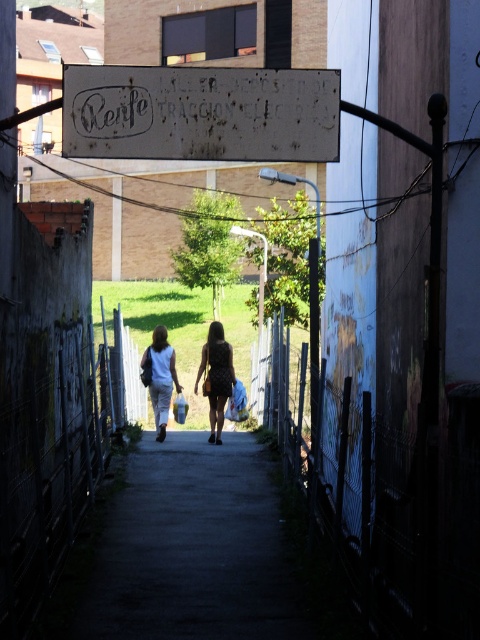
Does rusty metal sign at upper center appear under black dotted dress at center?

No.

Can you confirm if rusty metal sign at upper center is taller than black dotted dress at center?

No.

Does point (282, 92) lie in front of point (206, 371)?

Yes.

Locate an element on the screen. This screenshot has width=480, height=640. rusty metal sign at upper center is located at coordinates (201, 113).

Between point (208, 108) and point (156, 410), which one is positioned in front?

Point (208, 108) is in front.

Is rusty metal sign at upper center to the right of light blue sleeveless top at center from the viewer's perspective?

Indeed, rusty metal sign at upper center is positioned on the right side of light blue sleeveless top at center.

Is point (252, 122) farther from viewer compared to point (152, 392)?

No, it is not.

In order to click on rusty metal sign at upper center in this screenshot , I will do `click(201, 113)`.

Where is `black dotted dress at center`? The image size is (480, 640). black dotted dress at center is located at coordinates (216, 376).

Who is more distant from viewer, (214,397) or (167,410)?

The point (167,410) is behind.

The height and width of the screenshot is (640, 480). In order to click on black dotted dress at center in this screenshot , I will do [x=216, y=376].